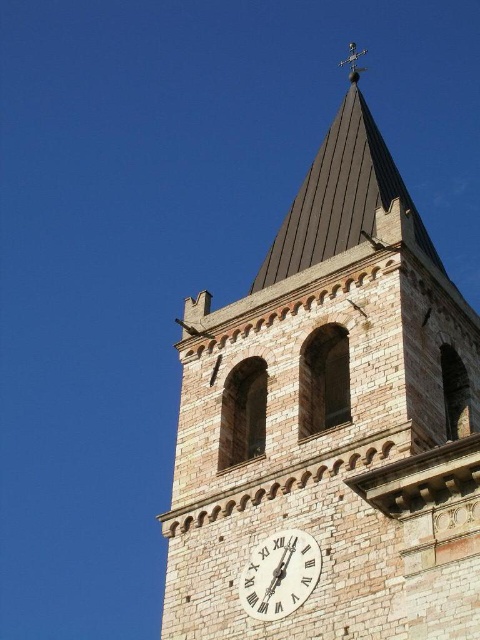
Who is positioned more to the left, brown stone clock tower at upper center or white stone clock at center?

Positioned to the left is brown stone clock tower at upper center.

Can you confirm if brown stone clock tower at upper center is bigger than white stone clock at center?

Yes.

Which is behind, point (476, 636) or point (263, 600)?

Positioned behind is point (263, 600).

At what (x,y) coordinates should I click in order to perform the action: click on brown stone clock tower at upper center. Please return your answer as a coordinate pair (x, y). The height and width of the screenshot is (640, 480). Looking at the image, I should click on (333, 417).